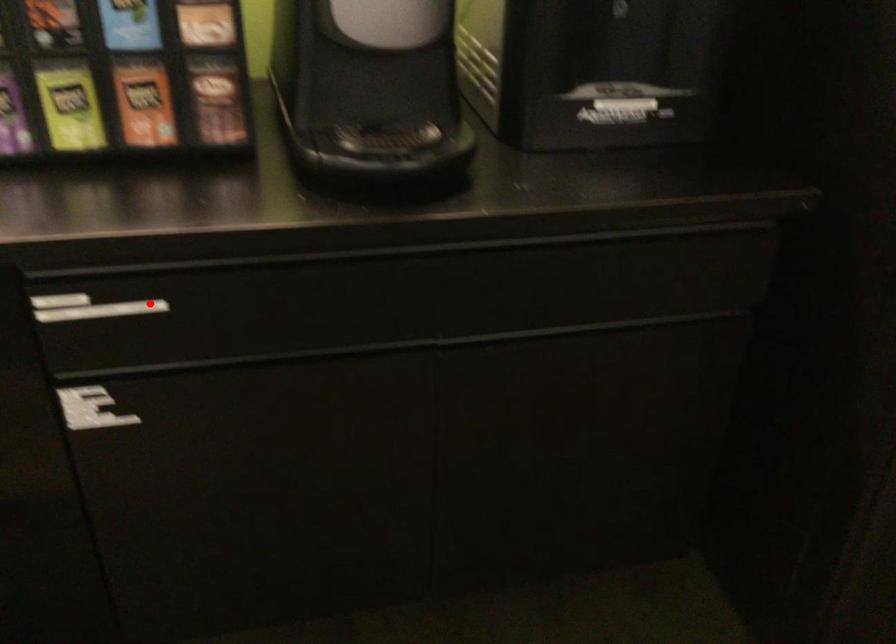
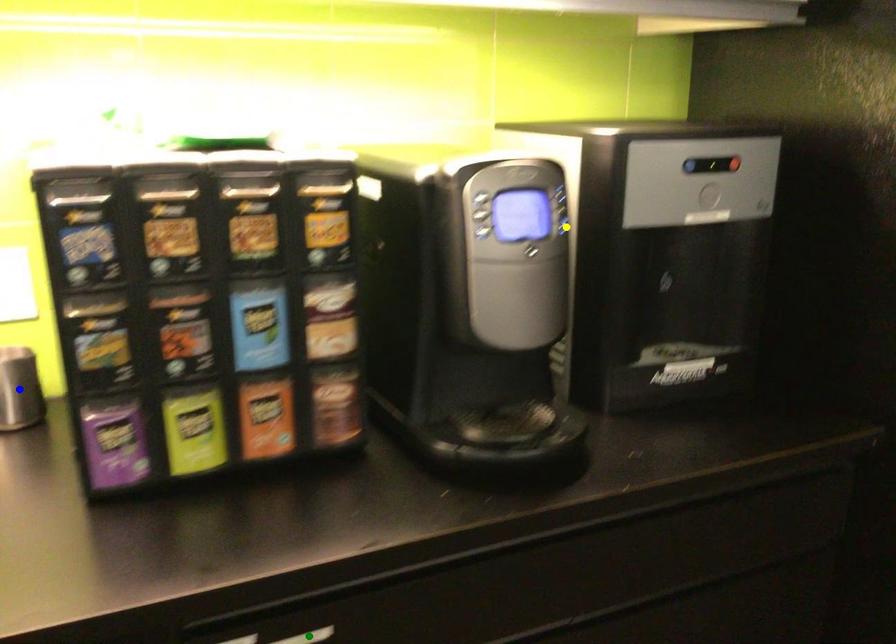
Question: I am providing you with two images of the same scene from different viewpoints. A red point is marked on the first image. You are given multiple points on the second image. Which point in image 2 is actually the same real-world point as the red point in image 1?

Choices:
 (A) green point
 (B) yellow point
 (C) blue point

Answer: (A)